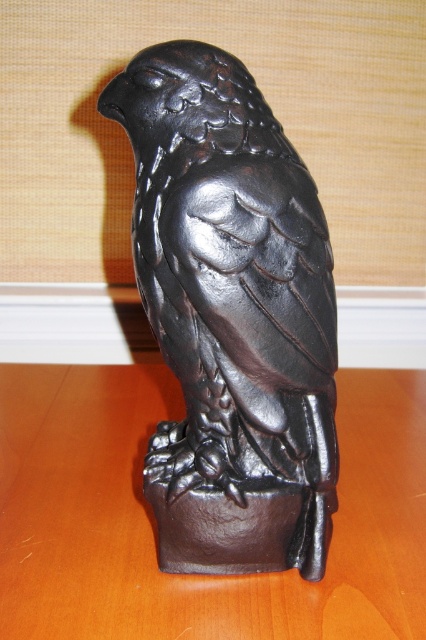
Does matte black bird at center have a larger size compared to brown matte table at center?

No, matte black bird at center is not bigger than brown matte table at center.

Between matte black bird at center and brown matte table at center, which one has more height?

With more height is matte black bird at center.

Who is more forward, [232,84] or [126,620]?

Point [232,84] is in front.

I want to click on matte black bird at center, so click(230, 316).